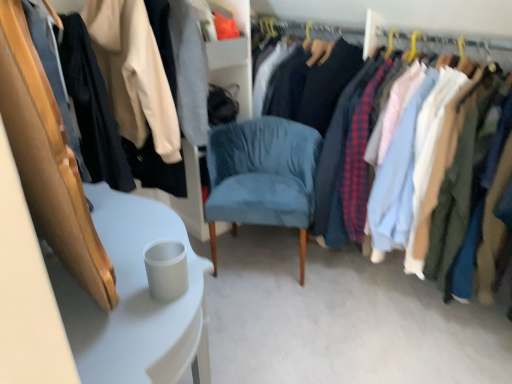
Question: From a real-world perspective, is matte black jacket at upper left, positioned as the 1th closet in left-to-right order, positioned under suede blue chair at center based on gravity?

Choices:
 (A) no
 (B) yes

Answer: (A)

Question: Can you confirm if matte black jacket at upper left, the second closet from the right, is bigger than suede blue chair at center?

Choices:
 (A) yes
 (B) no

Answer: (A)

Question: Does matte black jacket at upper left, positioned as the 1th closet in left-to-right order, come behind suede blue chair at center?

Choices:
 (A) yes
 (B) no

Answer: (B)

Question: Is matte black jacket at upper left, the second closet from the right, closer to camera compared to suede blue chair at center?

Choices:
 (A) yes
 (B) no

Answer: (A)

Question: Is suede blue chair at center located within matte black jacket at upper left, the second closet from the right?

Choices:
 (A) yes
 (B) no

Answer: (B)

Question: Is matte black jacket at upper left, positioned as the 1th closet in left-to-right order, not near suede blue chair at center?

Choices:
 (A) yes
 (B) no

Answer: (A)

Question: Is suede blue chair at center looking in the opposite direction of matte fabric shirts at right, the 1th closet viewed from the right?

Choices:
 (A) no
 (B) yes

Answer: (A)

Question: Can you confirm if suede blue chair at center is bigger than matte fabric shirts at right, the 2th closet when ordered from left to right?

Choices:
 (A) yes
 (B) no

Answer: (B)

Question: Considering the relative sizes of suede blue chair at center and matte fabric shirts at right, the 2th closet when ordered from left to right, in the image provided, is suede blue chair at center taller than matte fabric shirts at right, the 2th closet when ordered from left to right,?

Choices:
 (A) yes
 (B) no

Answer: (B)

Question: Is suede blue chair at center further to camera compared to matte fabric shirts at right, the 1th closet viewed from the right?

Choices:
 (A) no
 (B) yes

Answer: (B)

Question: Can you confirm if suede blue chair at center is shorter than matte fabric shirts at right, the 1th closet viewed from the right?

Choices:
 (A) no
 (B) yes

Answer: (B)

Question: Could matte fabric shirts at right, the 1th closet viewed from the right, be considered to be inside suede blue chair at center?

Choices:
 (A) yes
 (B) no

Answer: (B)

Question: Is white glossy table at lower left positioned before suede blue chair at center?

Choices:
 (A) no
 (B) yes

Answer: (B)